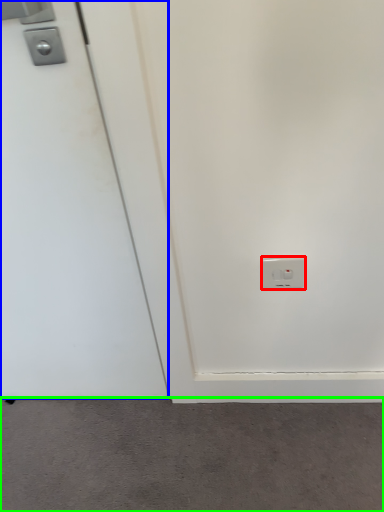
Question: Estimate the real-world distances between objects in this image. Which object is farther from power plugs and sockets (highlighted by a red box), door (highlighted by a blue box) or concrete (highlighted by a green box)?

Choices:
 (A) door
 (B) concrete

Answer: (B)